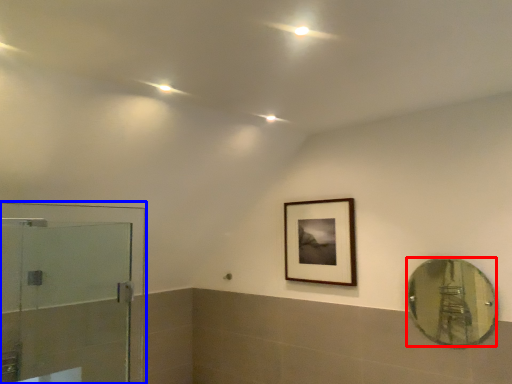
Question: Which object is closer to the camera taking this photo, mirror (highlighted by a red box) or screen door (highlighted by a blue box)?

Choices:
 (A) mirror
 (B) screen door

Answer: (B)